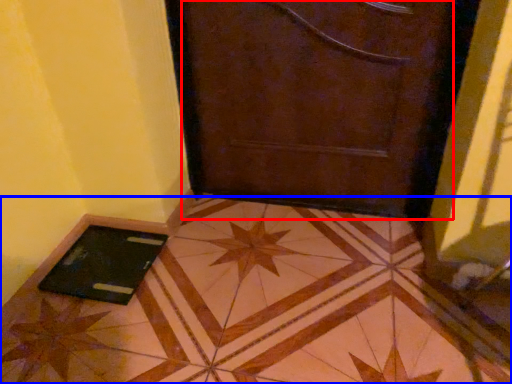
Question: Which of the following is the closest to the observer, door (highlighted by a red box) or tile (highlighted by a blue box)?

Choices:
 (A) door
 (B) tile

Answer: (B)